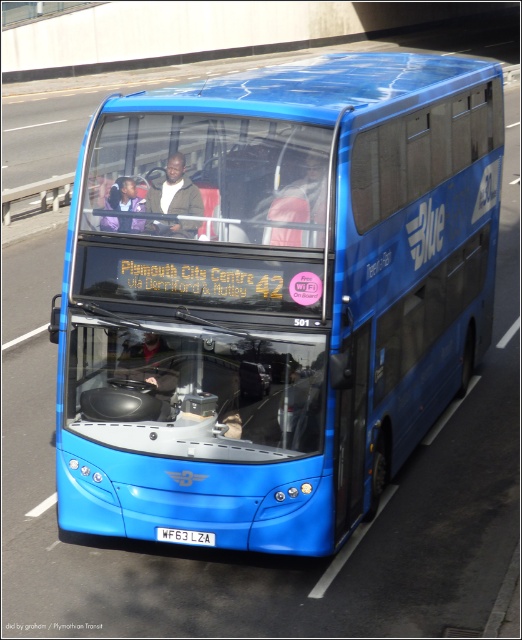
You are standing at the origin point of the coordinate system. The blue metallic bus at center is located at coordinates 0.463, 0.527. If you want to walk directly towards the bus, in which direction should you move?

Since the blue metallic bus at center is located at coordinates (275,296), you should move northeast to reach it.